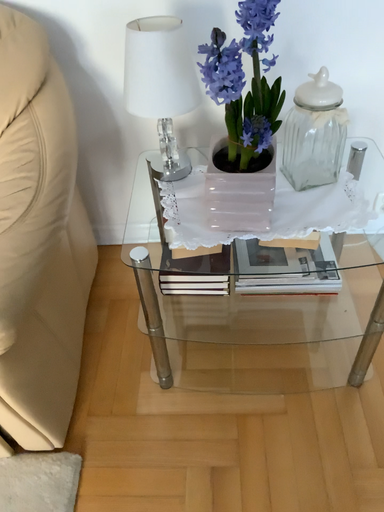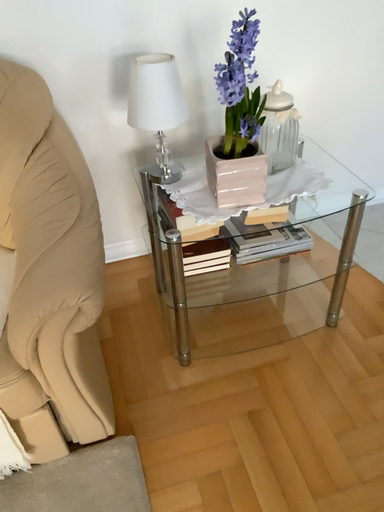
Question: How did the camera likely rotate when shooting the video?

Choices:
 (A) rotated left
 (B) rotated right

Answer: (B)